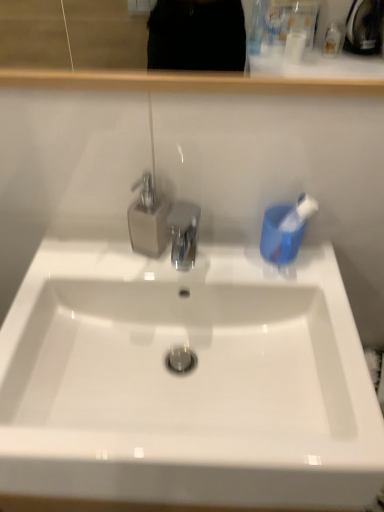
Question: Considering the positions of white glossy sink at center and blue plastic toothbrush at right in the image, is white glossy sink at center wider or thinner than blue plastic toothbrush at right?

Choices:
 (A) thin
 (B) wide

Answer: (B)

Question: Is white glossy sink at center inside the boundaries of blue plastic toothbrush at right, or outside?

Choices:
 (A) inside
 (B) outside

Answer: (B)

Question: Which object is the closest to the blue plastic toothbrush at right?

Choices:
 (A) white glossy sink at center
 (B) transparent plastic tap at center

Answer: (B)

Question: Which of these objects is positioned farthest from the blue plastic toothbrush at right?

Choices:
 (A) transparent plastic tap at center
 (B) white glossy sink at center

Answer: (B)